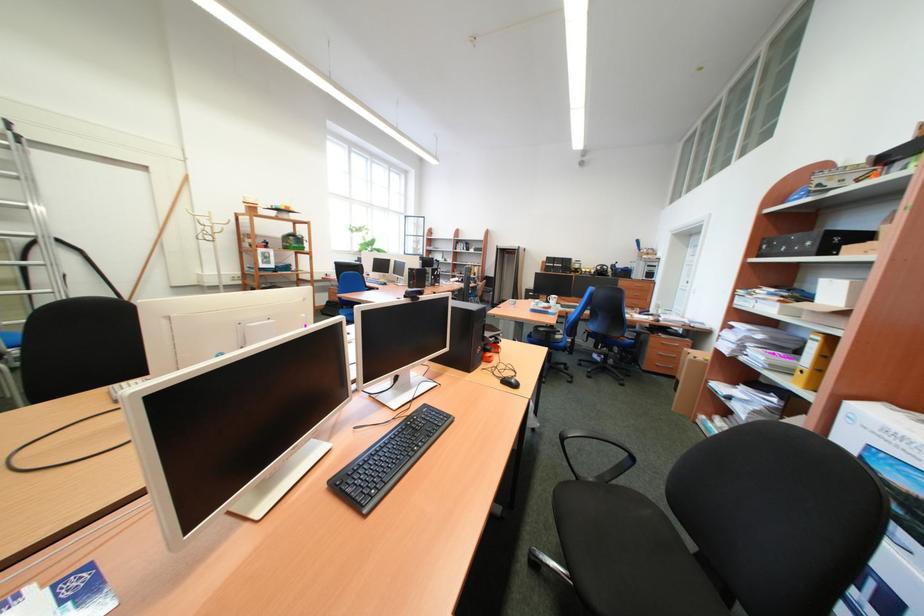
This screenshot has height=616, width=924. Describe the element at coordinates (615, 537) in the screenshot. I see `the black chair sitting surface` at that location.